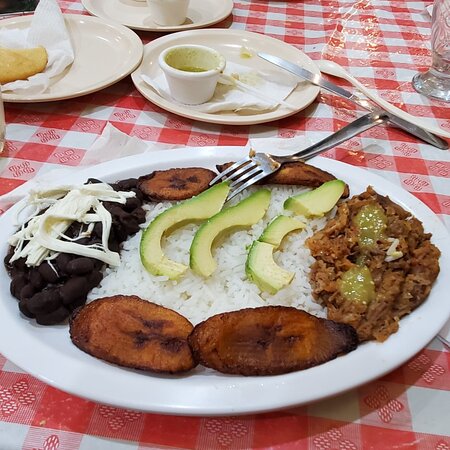
Locate an element on the screen. sauce cup is located at coordinates (196, 85), (166, 14).